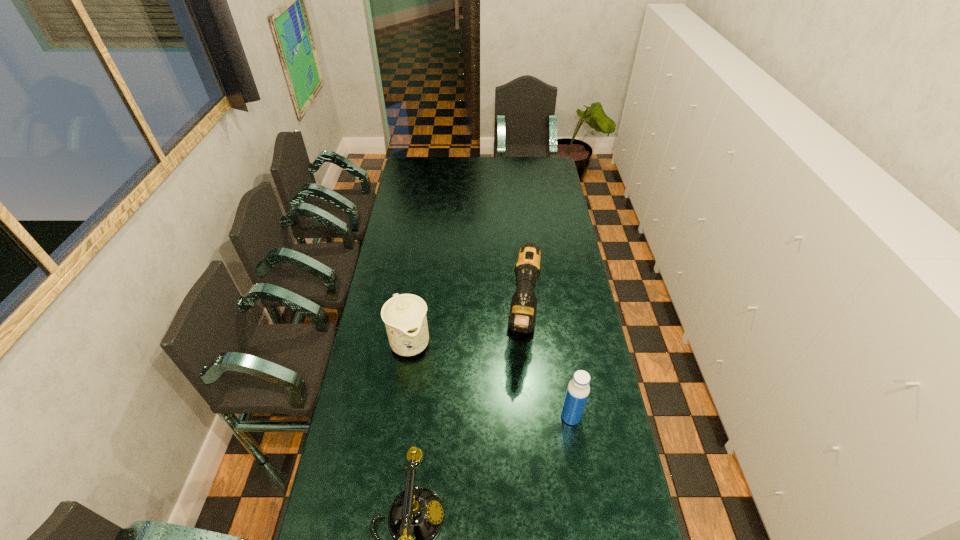
Where is `free spot on the desktop that is between the nearest object and the third farthest object and is positioned at the tip of the tallest object`? The width and height of the screenshot is (960, 540). free spot on the desktop that is between the nearest object and the third farthest object and is positioned at the tip of the tallest object is located at coordinates (514, 453).

Where is `free space on the desktop that is between the telephone and the water bottle and is positioned on the spout of the chinaware`? free space on the desktop that is between the telephone and the water bottle and is positioned on the spout of the chinaware is located at coordinates (472, 480).